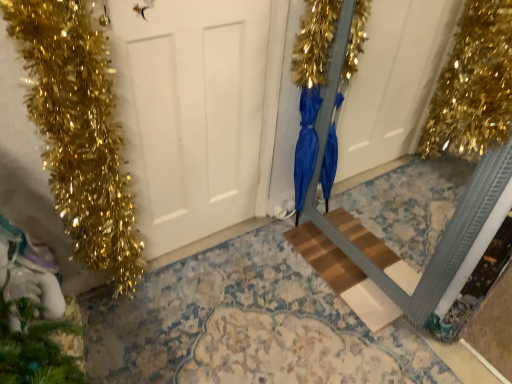
In order to click on green matte pine cone at lower left in this screenshot , I will do `click(35, 348)`.

You are a GUI agent. You are given a task and a screenshot of the screen. Output one action in this format:
    pyautogui.click(x=<x>, y=<y>)
    Task: Click on the blue satin dress at center
    This screenshot has width=512, height=384.
    Given the screenshot: What is the action you would take?
    pyautogui.click(x=306, y=145)

I want to click on wooden step at center, so click(x=343, y=276).

From the picture: Could you tell me if green matte pine cone at lower left is turned towards wooden step at center?

Yes, green matte pine cone at lower left faces towards wooden step at center.

Are green matte pine cone at lower left and wooden step at center located far from each other?

Indeed, green matte pine cone at lower left is not near wooden step at center.

Who is taller, green matte pine cone at lower left or wooden step at center?

Result: With more height is green matte pine cone at lower left.

This screenshot has height=384, width=512. What are the coordinates of `stairwell lying above the green matte pine cone at lower left (from the image's perspective)` in the screenshot? It's located at (343, 276).

Where is `christmas decoration beneath the white matte door at center (from a real-world perspective)`? christmas decoration beneath the white matte door at center (from a real-world perspective) is located at coordinates (35, 348).

Is green matte pine cone at lower left taller than white matte door at center?

No, green matte pine cone at lower left is not taller than white matte door at center.

Based on the photo, between green matte pine cone at lower left and white matte door at center, which one has smaller size?

With smaller size is green matte pine cone at lower left.

Does green matte pine cone at lower left have a greater width compared to white matte door at center?

Indeed, green matte pine cone at lower left has a greater width compared to white matte door at center.

Which object is more forward, green matte pine cone at lower left or blue satin dress at center?

Positioned in front is green matte pine cone at lower left.

Consider the image. Between green matte pine cone at lower left and blue satin dress at center, which one has smaller size?

Smaller between the two is green matte pine cone at lower left.

Which is more to the right, green matte pine cone at lower left or blue satin dress at center?

From the viewer's perspective, blue satin dress at center appears more on the right side.

What's the angular difference between green matte pine cone at lower left and blue satin dress at center's facing directions?

green matte pine cone at lower left and blue satin dress at center are facing 168 degrees away from each other.

From the image's perspective, between wooden step at center and white matte door at center, who is located below?

wooden step at center is shown below in the image.

From a real-world perspective, is wooden step at center positioned over white matte door at center based on gravity?

No.

How many degrees apart are the facing directions of wooden step at center and white matte door at center?

wooden step at center and white matte door at center are facing 89.3 degrees away from each other.

Is wooden step at center positioned with its back to white matte door at center?

wooden step at center is not turned away from white matte door at center.

The image size is (512, 384). Identify the location of dress behind the white matte door at center. pyautogui.click(x=306, y=145).

Is blue satin dress at center wider or thinner than white matte door at center?

blue satin dress at center is wider than white matte door at center.

In the scene shown: Does blue satin dress at center turn towards white matte door at center?

Yes, blue satin dress at center is aimed at white matte door at center.

Is wooden step at center further to camera compared to blue satin dress at center?

Yes, it is behind blue satin dress at center.

Measure the distance from wooden step at center to blue satin dress at center.

wooden step at center is 13.18 inches from blue satin dress at center.

From a real-world perspective, who is located lower, wooden step at center or blue satin dress at center?

wooden step at center is physically lower.

Where is `dress above the wooden step at center (from the image's perspective)`? dress above the wooden step at center (from the image's perspective) is located at coordinates (306, 145).

From the image's perspective, relative to blue satin dress at center, is white matte door at center above or below?

Based on their image positions, white matte door at center is located above blue satin dress at center.

Would you say blue satin dress at center is part of white matte door at center's contents?

Actually, blue satin dress at center is outside white matte door at center.

Which point is more forward, [222,12] or [325,149]?

The point [222,12] is more forward.

From a real-world perspective, relative to blue satin dress at center, is white matte door at center vertically above or below?

Clearly, from a real-world perspective, white matte door at center is above blue satin dress at center.

Identify the location of christmas decoration above the wooden step at center (from a real-world perspective). (35, 348).

Where is `christmas decoration located behind the white matte door at center`? christmas decoration located behind the white matte door at center is located at coordinates (35, 348).

Looking at the image, which one is located closer to blue satin dress at center, wooden step at center or green matte pine cone at lower left?

wooden step at center.

Based on their spatial positions, is wooden step at center or blue satin dress at center further from green matte pine cone at lower left?

blue satin dress at center.

Estimate the real-world distances between objects in this image. Which object is further from green matte pine cone at lower left, blue satin dress at center or white matte door at center?

blue satin dress at center lies further to green matte pine cone at lower left than the other object.

From the image, which object appears to be farther from green matte pine cone at lower left, blue satin dress at center or wooden step at center?

Based on the image, blue satin dress at center appears to be further to green matte pine cone at lower left.

Based on their spatial positions, is green matte pine cone at lower left or wooden step at center further from blue satin dress at center?

Based on the image, green matte pine cone at lower left appears to be further to blue satin dress at center.

Considering their positions, is blue satin dress at center positioned closer to wooden step at center than green matte pine cone at lower left?

blue satin dress at center is closer to wooden step at center.

Estimate the real-world distances between objects in this image. Which object is further from wooden step at center, blue satin dress at center or white matte door at center?

The object further to wooden step at center is white matte door at center.

Estimate the real-world distances between objects in this image. Which object is closer to blue satin dress at center, green matte pine cone at lower left or white matte door at center?

white matte door at center lies closer to blue satin dress at center than the other object.

Locate an element on the screen. The image size is (512, 384). door between green matte pine cone at lower left and wooden step at center from left to right is located at coordinates (191, 113).

At what (x,y) coordinates should I click in order to perform the action: click on door between green matte pine cone at lower left and blue satin dress at center. Please return your answer as a coordinate pair (x, y). Image resolution: width=512 pixels, height=384 pixels. Looking at the image, I should click on (191, 113).

Image resolution: width=512 pixels, height=384 pixels. Identify the location of dress between white matte door at center and wooden step at center in the horizontal direction. (306, 145).

Where is `dress between green matte pine cone at lower left and wooden step at center in the horizontal direction`? This screenshot has width=512, height=384. dress between green matte pine cone at lower left and wooden step at center in the horizontal direction is located at coordinates (306, 145).